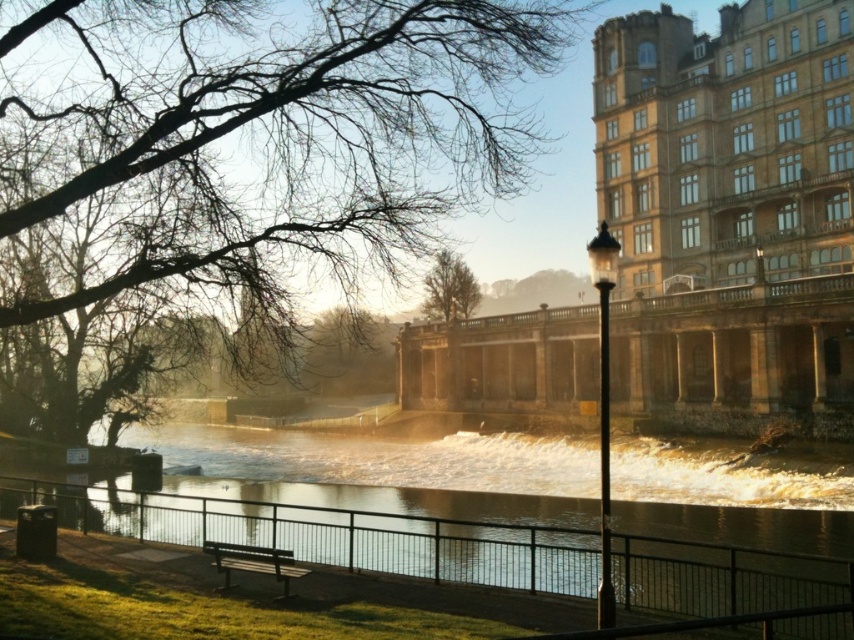
Is point (355, 634) closer to camera compared to point (446, 296)?

Yes.

Consider the image. Is the position of shiny metallic water at center more distant than that of green leafy tree at center?

No, shiny metallic water at center is in front of green leafy tree at center.

Is point (531, 504) in front of point (451, 273)?

Yes, it is.

The height and width of the screenshot is (640, 854). I want to click on shiny metallic water at center, so click(367, 529).

Can you confirm if bare branches at upper left is positioned to the right of shiny metallic water at center?

Yes, bare branches at upper left is to the right of shiny metallic water at center.

Does bare branches at upper left appear over shiny metallic water at center?

Correct, bare branches at upper left is located above shiny metallic water at center.

Is point (13, 76) less distant than point (158, 515)?

No.

Where is `bare branches at upper left`? The image size is (854, 640). bare branches at upper left is located at coordinates (249, 147).

Is bare branches at upper left further to camera compared to green leafy tree at center?

No, it is in front of green leafy tree at center.

What do you see at coordinates (249, 147) in the screenshot? This screenshot has height=640, width=854. I see `bare branches at upper left` at bounding box center [249, 147].

I want to click on bare branches at upper left, so click(249, 147).